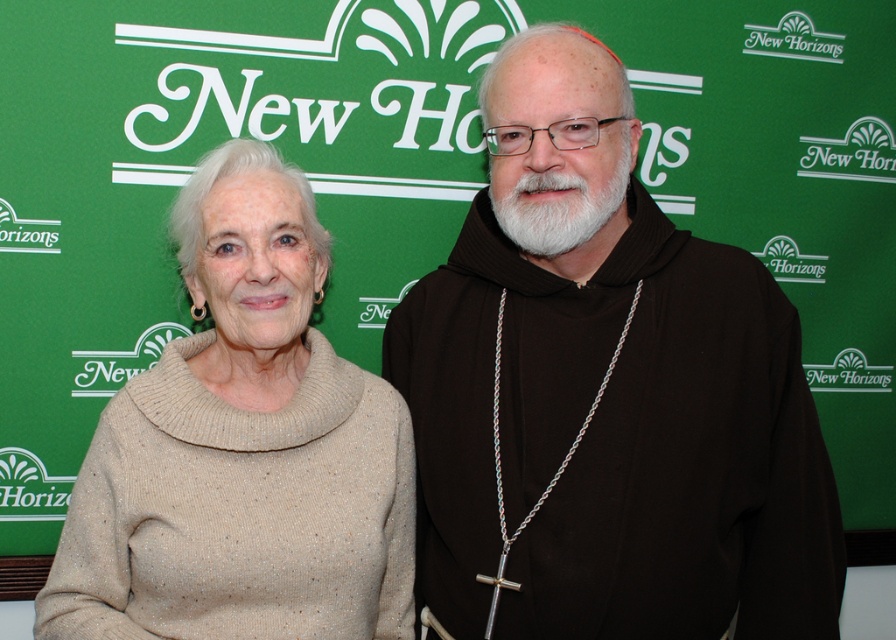
You are organizing a photo shoot and need to ensure that the clothing items in the image are displayed properly. Given that the brown woolen robe at center and the beige sweater at left are part of the wardrobe, which clothing item requires more space to hang due to its size?

The brown woolen robe at center requires more space to hang because its width is larger than the beige sweater at left.

You are an interior designer observing the scene. You need to place a decorative shelf between the brown woolen robe at center and the beige sweater at left. Based on their positions, where should the shelf be placed?

The brown woolen robe at center is located above the beige sweater at left, so the shelf should be placed below the brown woolen robe at center and above the beige sweater at left to fit between them.

In the scene shown: You are an artist trying to sketch the scene. You need to place the brown woolen robe at center in your drawing. According to the scene description, where should you position it on your canvas using the coordinate system provided?

The brown woolen robe at center should be positioned at the coordinate point (605, 394) on the canvas.